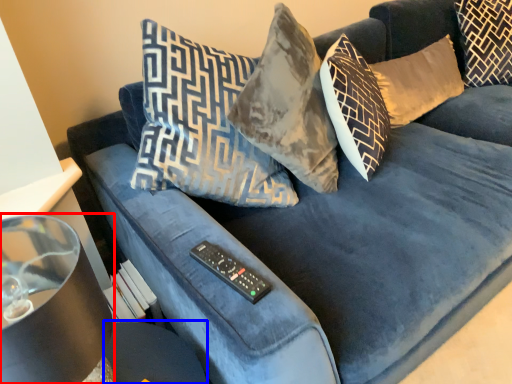
Question: Among these objects, which one is farthest to the camera, lamp (highlighted by a red box) or glass table (highlighted by a blue box)?

Choices:
 (A) lamp
 (B) glass table

Answer: (B)